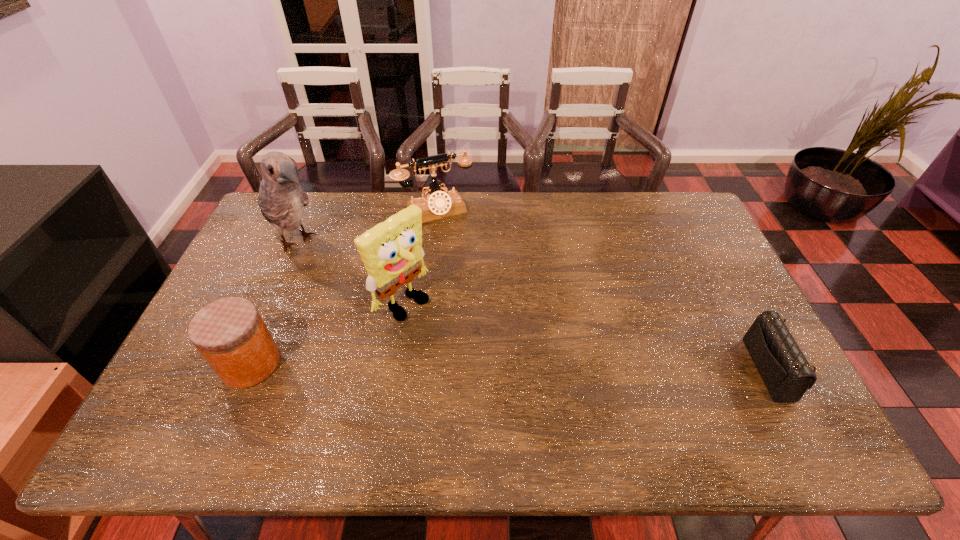
I want to click on jar, so click(x=230, y=334).

The image size is (960, 540). In order to click on the shortest object in this screenshot , I will do `click(786, 373)`.

This screenshot has height=540, width=960. What are the coordinates of `clutch bag` in the screenshot? It's located at (786, 373).

At what (x,y) coordinates should I click in order to perform the action: click on the fourth shortest object. Please return your answer as a coordinate pair (x, y). Looking at the image, I should click on (391, 251).

Image resolution: width=960 pixels, height=540 pixels. In order to click on the third farthest object in this screenshot , I will do `click(391, 251)`.

You are a GUI agent. You are given a task and a screenshot of the screen. Output one action in this format:
    pyautogui.click(x=<x>, y=<y>)
    Task: Click on the parrot
    
    Given the screenshot: What is the action you would take?
    pyautogui.click(x=282, y=199)

Where is `the third shortest object`? This screenshot has width=960, height=540. the third shortest object is located at coordinates click(437, 204).

You are a GUI agent. You are given a task and a screenshot of the screen. Output one action in this format:
    pyautogui.click(x=<x>, y=<y>)
    Task: Click on the vacant space located 0.090m on the left of the jar
    
    Given the screenshot: What is the action you would take?
    pyautogui.click(x=187, y=363)

I want to click on free space located on the face of the sponge, so coord(520,393).

Where is `vacant region located 0.230m on the face of the sponge`? vacant region located 0.230m on the face of the sponge is located at coordinates (481, 362).